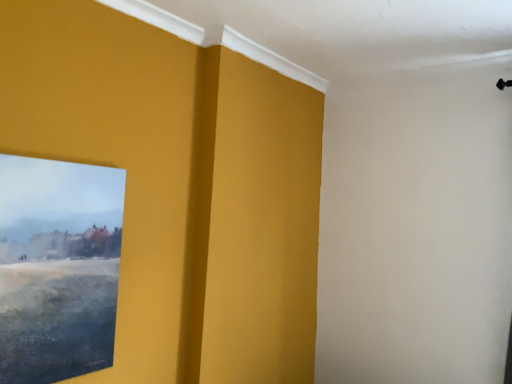
What is the approximate width of matte paper painting at left?

It is 5.34 centimeters.

Describe the element at coordinates (58, 267) in the screenshot. Image resolution: width=512 pixels, height=384 pixels. I see `matte paper painting at left` at that location.

At what (x,y) coordinates should I click in order to perform the action: click on matte paper painting at left. Please return your answer as a coordinate pair (x, y). Looking at the image, I should click on (58, 267).

Where is `matte paper painting at left`? matte paper painting at left is located at coordinates (58, 267).